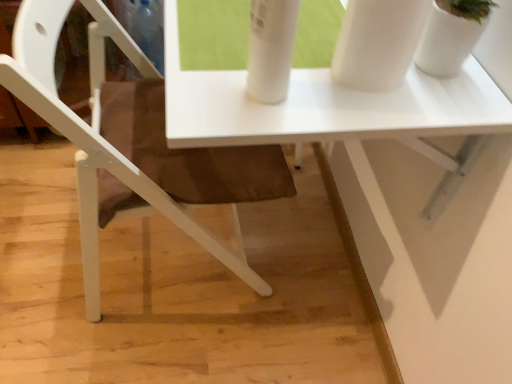
Identify the location of vacant location below white glossy table at center (from a real-world perspective). (298, 246).